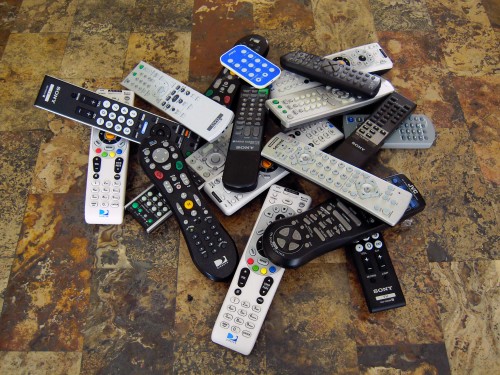
The width and height of the screenshot is (500, 375). Identify the location of floor. (461, 256).